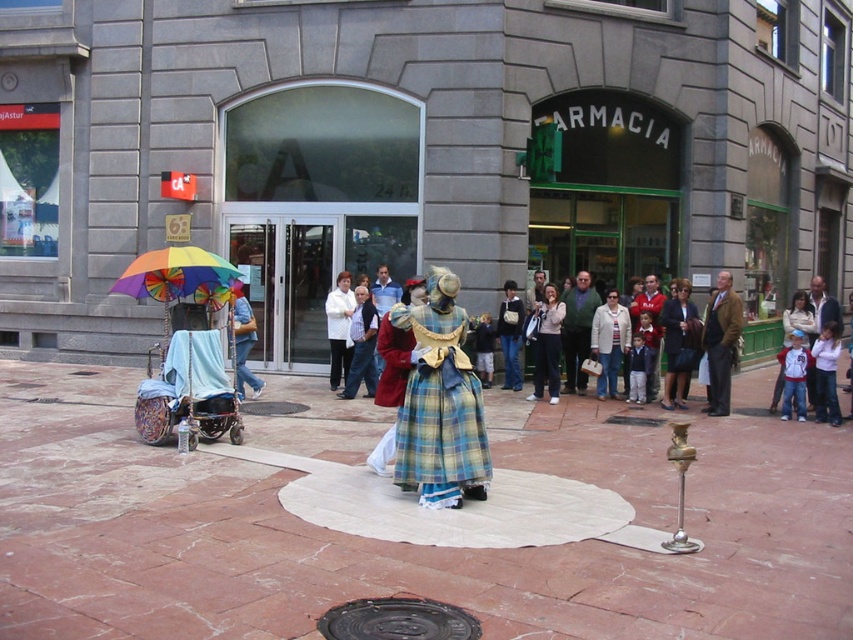
You are a fashion designer observing the scene at the pharmacy. You notice two garments at the center of the circular area. Which garment is taller between the brown leather jacket at center and the matte pink sweater at center?

The brown leather jacket at center is taller than the matte pink sweater at center according to the description.